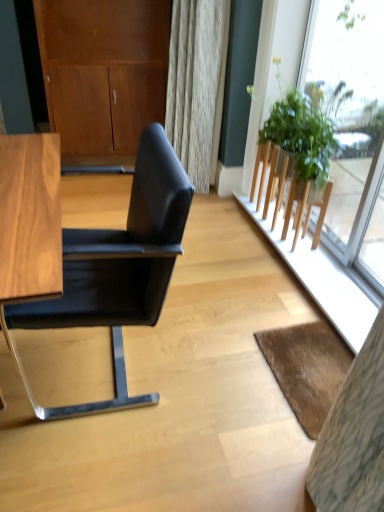
The width and height of the screenshot is (384, 512). Identify the location of vacant space to the right of black leather chair at left. (221, 364).